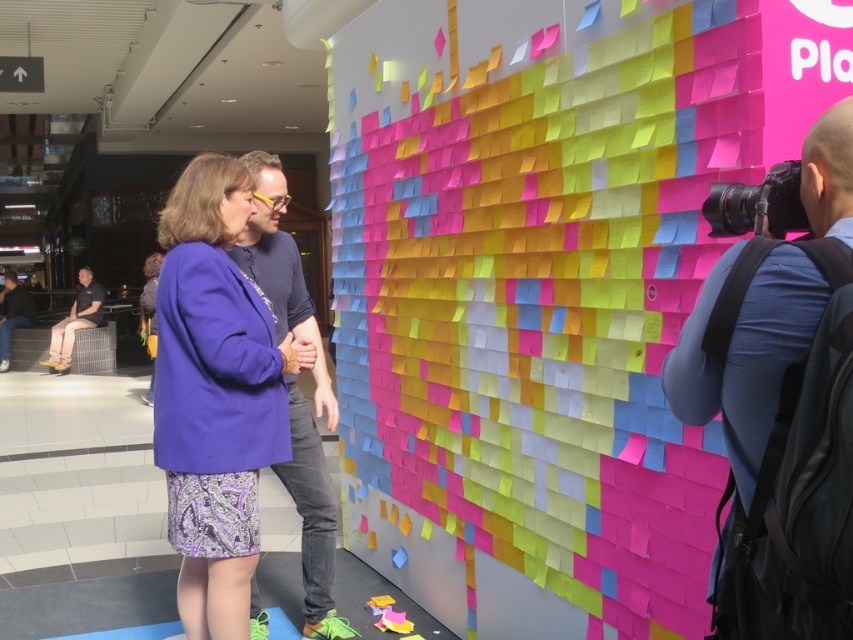
Question: Is purple fabric skirt at center in front of khaki cotton pants at lower left?

Choices:
 (A) no
 (B) yes

Answer: (B)

Question: Can you confirm if purple soft fabric sweatshirt at center is thinner than dark gray jeans at lower left?

Choices:
 (A) yes
 (B) no

Answer: (A)

Question: Which of the following is the closest to the observer?

Choices:
 (A) blue fabric camera at right
 (B) dark gray jeans at lower left

Answer: (A)

Question: Which of the following is the farthest from the observer?

Choices:
 (A) (323, 486)
 (B) (99, 300)
 (C) (20, 324)

Answer: (C)

Question: Is purple fabric skirt at center bigger than khaki cotton pants at lower left?

Choices:
 (A) yes
 (B) no

Answer: (B)

Question: Which point appears farthest from the camera in this image?

Choices:
 (A) (6, 353)
 (B) (230, 314)

Answer: (A)